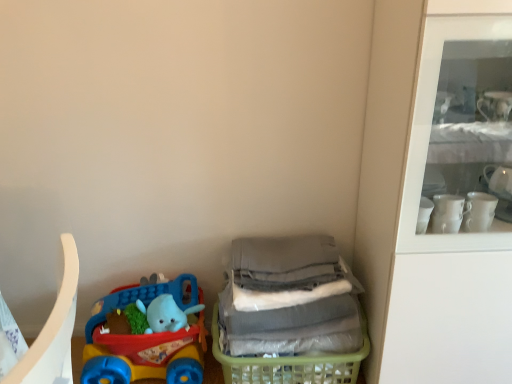
Question: From the image's perspective, is plastic toy car at lower left positioned above or below translucent green plastic basket at lower right?

Choices:
 (A) below
 (B) above

Answer: (B)

Question: Based on their sizes in the image, would you say plastic toy car at lower left is bigger or smaller than translucent green plastic basket at lower right?

Choices:
 (A) big
 (B) small

Answer: (B)

Question: Does point (92, 362) appear closer or farther from the camera than point (265, 374)?

Choices:
 (A) farther
 (B) closer

Answer: (A)

Question: From their relative heights in the image, would you say translucent green plastic basket at lower right is taller or shorter than plastic toy car at lower left?

Choices:
 (A) short
 (B) tall

Answer: (A)

Question: Is translucent green plastic basket at lower right wider or thinner than plastic toy car at lower left?

Choices:
 (A) wide
 (B) thin

Answer: (A)

Question: Is translucent green plastic basket at lower right bigger or smaller than plastic toy car at lower left?

Choices:
 (A) big
 (B) small

Answer: (A)

Question: Would you say translucent green plastic basket at lower right is to the left or to the right of plastic toy car at lower left in the picture?

Choices:
 (A) left
 (B) right

Answer: (B)